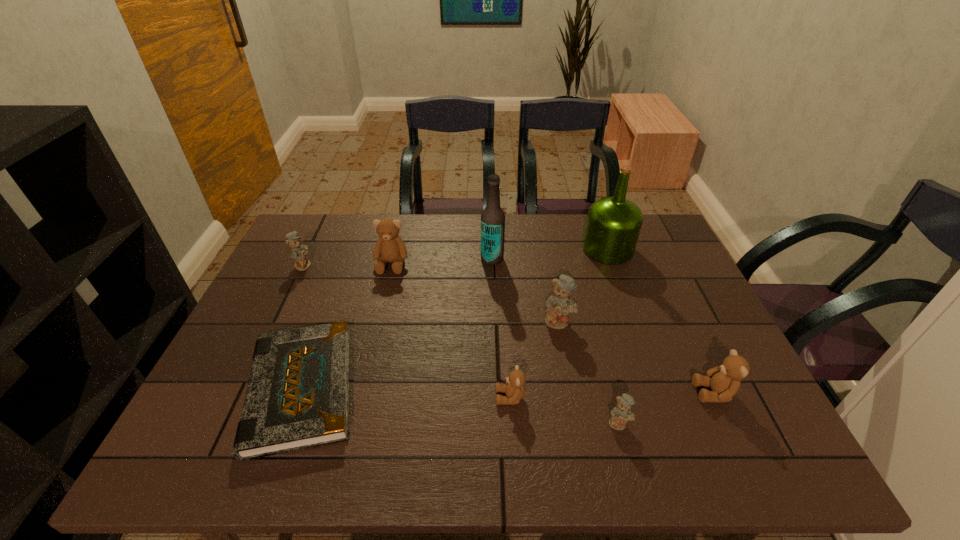
Identify the location of object that is at the near left corner. Image resolution: width=960 pixels, height=540 pixels. (297, 397).

In order to click on object at the far right corner in this screenshot , I will do [613, 225].

The height and width of the screenshot is (540, 960). In the image, there is a desktop. In order to click on vacant space at the far edge in this screenshot , I will do `click(349, 216)`.

In the image, there is a desktop. Identify the location of vacant space at the near edge. The width and height of the screenshot is (960, 540). (533, 431).

Image resolution: width=960 pixels, height=540 pixels. What are the coordinates of `free space at the left edge of the desktop` in the screenshot? It's located at (234, 360).

The image size is (960, 540). In the image, there is a desktop. Find the location of `free region at the right edge`. free region at the right edge is located at coordinates (687, 294).

Where is `vacant space at the far left corner of the desktop`? This screenshot has width=960, height=540. vacant space at the far left corner of the desktop is located at coordinates (328, 219).

Where is `blank space at the near left corner of the desktop`? This screenshot has width=960, height=540. blank space at the near left corner of the desktop is located at coordinates (231, 456).

Where is `vacant region at the far right corner of the desktop`? Image resolution: width=960 pixels, height=540 pixels. vacant region at the far right corner of the desktop is located at coordinates [657, 252].

The image size is (960, 540). Find the location of `free space between the beer bottle and the leftmost brown teddy bear`. free space between the beer bottle and the leftmost brown teddy bear is located at coordinates (442, 261).